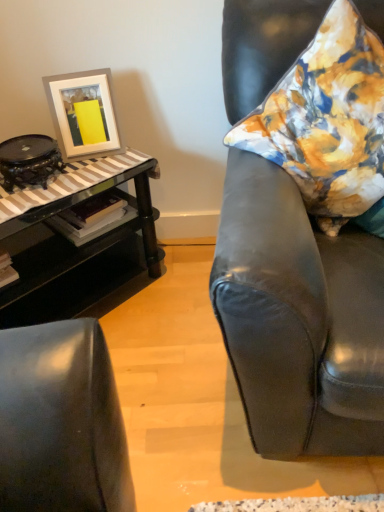
Question: Would you say white matte picture frame at upper left contains matte black armchair at right?

Choices:
 (A) yes
 (B) no

Answer: (B)

Question: Is white matte picture frame at upper left to the right of matte black armchair at right from the viewer's perspective?

Choices:
 (A) no
 (B) yes

Answer: (A)

Question: Is white matte picture frame at upper left outside of matte black armchair at right?

Choices:
 (A) no
 (B) yes

Answer: (B)

Question: Is white matte picture frame at upper left at the left side of matte black armchair at right?

Choices:
 (A) yes
 (B) no

Answer: (A)

Question: Does white matte picture frame at upper left have a greater height compared to matte black armchair at right?

Choices:
 (A) no
 (B) yes

Answer: (A)

Question: From a real-world perspective, is white matte picture frame at upper left above or below black glass table at left?

Choices:
 (A) below
 (B) above

Answer: (B)

Question: Is white matte picture frame at upper left bigger or smaller than black glass table at left?

Choices:
 (A) small
 (B) big

Answer: (A)

Question: In the image, is white matte picture frame at upper left positioned in front of or behind black glass table at left?

Choices:
 (A) front
 (B) behind

Answer: (B)

Question: Do you think white matte picture frame at upper left is within black glass table at left, or outside of it?

Choices:
 (A) inside
 (B) outside

Answer: (B)

Question: Looking at the image, does matte black armchair at right seem bigger or smaller compared to white matte picture frame at upper left?

Choices:
 (A) small
 (B) big

Answer: (B)

Question: Is matte black armchair at right in front of or behind white matte picture frame at upper left in the image?

Choices:
 (A) behind
 (B) front

Answer: (B)

Question: Is point (240, 247) positioned closer to the camera than point (84, 92)?

Choices:
 (A) closer
 (B) farther

Answer: (A)

Question: From the image's perspective, relative to white matte picture frame at upper left, is matte black armchair at right above or below?

Choices:
 (A) above
 (B) below

Answer: (B)

Question: In terms of height, does black glass table at left look taller or shorter compared to matte black armchair at right?

Choices:
 (A) tall
 (B) short

Answer: (B)

Question: Relative to matte black armchair at right, is black glass table at left in front or behind?

Choices:
 (A) front
 (B) behind

Answer: (B)